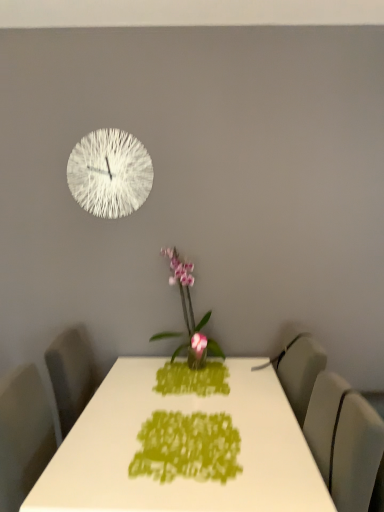
Question: Is pink glossy orchid at center looking in the opposite direction of matte gray swivel chair at right?

Choices:
 (A) yes
 (B) no

Answer: (B)

Question: Is pink glossy orchid at center in contact with matte gray swivel chair at right?

Choices:
 (A) yes
 (B) no

Answer: (B)

Question: Does pink glossy orchid at center come behind matte gray swivel chair at right?

Choices:
 (A) yes
 (B) no

Answer: (A)

Question: Is pink glossy orchid at center not inside matte gray swivel chair at right?

Choices:
 (A) yes
 (B) no

Answer: (A)

Question: From a real-world perspective, is pink glossy orchid at center beneath matte gray swivel chair at right?

Choices:
 (A) no
 (B) yes

Answer: (A)

Question: In terms of size, does pink glossy orchid at center appear bigger or smaller than matte gray swivel chair at right?

Choices:
 (A) big
 (B) small

Answer: (A)

Question: Is pink glossy orchid at center in front of or behind matte gray swivel chair at right in the image?

Choices:
 (A) behind
 (B) front

Answer: (A)

Question: From the image's perspective, is pink glossy orchid at center positioned above or below matte gray swivel chair at right?

Choices:
 (A) above
 (B) below

Answer: (A)

Question: In terms of width, does pink glossy orchid at center look wider or thinner when compared to matte gray swivel chair at right?

Choices:
 (A) thin
 (B) wide

Answer: (A)

Question: From a real-world perspective, is pink glossy orchid at center positioned above or below white textured clock at upper left?

Choices:
 (A) below
 (B) above

Answer: (A)

Question: Is pink glossy orchid at center bigger or smaller than white textured clock at upper left?

Choices:
 (A) small
 (B) big

Answer: (B)

Question: Is pink glossy orchid at center taller or shorter than white textured clock at upper left?

Choices:
 (A) short
 (B) tall

Answer: (B)

Question: Considering the positions of point (211, 351) and point (115, 169), is point (211, 351) closer or farther from the camera than point (115, 169)?

Choices:
 (A) closer
 (B) farther

Answer: (B)

Question: Would you say matte gray swivel chair at right is inside or outside white glossy table at center?

Choices:
 (A) inside
 (B) outside

Answer: (B)

Question: Looking at their shapes, would you say matte gray swivel chair at right is wider or thinner than white glossy table at center?

Choices:
 (A) thin
 (B) wide

Answer: (A)